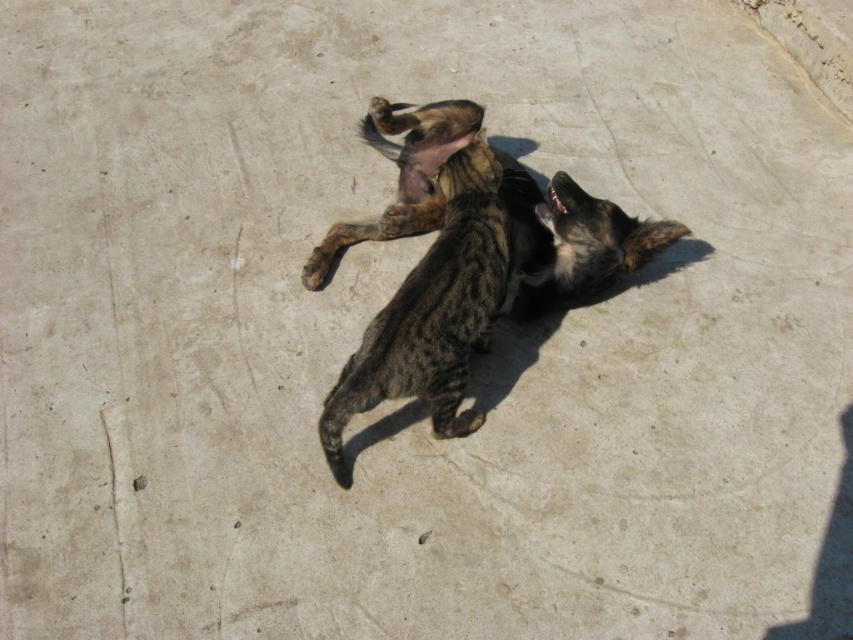
Question: Which of the following is the farthest from the observer?

Choices:
 (A) brown fur dog at center
 (B) dark brown fur paw at upper center

Answer: (B)

Question: Is brown fur dog at center thinner than dark brown fur paw at upper center?

Choices:
 (A) no
 (B) yes

Answer: (A)

Question: Is brown fur dog at center to the left of dark brown fur paw at upper center from the viewer's perspective?

Choices:
 (A) yes
 (B) no

Answer: (B)

Question: Can you confirm if brown fur dog at center is smaller than dark brown fur paw at upper center?

Choices:
 (A) yes
 (B) no

Answer: (B)